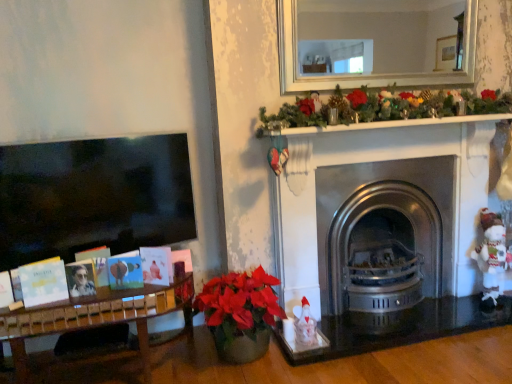
Question: From the image's perspective, is polished stainless steel fireplace at center below white knitted toy at right?

Choices:
 (A) yes
 (B) no

Answer: (B)

Question: Can you confirm if polished stainless steel fireplace at center is smaller than white knitted toy at right?

Choices:
 (A) no
 (B) yes

Answer: (A)

Question: Is polished stainless steel fireplace at center shorter than white knitted toy at right?

Choices:
 (A) yes
 (B) no

Answer: (B)

Question: From a real-world perspective, does polished stainless steel fireplace at center stand above white knitted toy at right?

Choices:
 (A) yes
 (B) no

Answer: (A)

Question: Would you say white knitted toy at right is part of polished stainless steel fireplace at center's contents?

Choices:
 (A) no
 (B) yes

Answer: (A)

Question: Considering the relative sizes of polished stainless steel fireplace at center and white knitted toy at right in the image provided, is polished stainless steel fireplace at center wider than white knitted toy at right?

Choices:
 (A) yes
 (B) no

Answer: (A)

Question: Is white knitted toy at right oriented towards polished stainless steel fireplace at center?

Choices:
 (A) no
 (B) yes

Answer: (A)

Question: Can you confirm if white knitted toy at right is taller than polished stainless steel fireplace at center?

Choices:
 (A) no
 (B) yes

Answer: (A)

Question: Is white knitted toy at right wider than polished stainless steel fireplace at center?

Choices:
 (A) no
 (B) yes

Answer: (A)

Question: Can you confirm if white knitted toy at right is smaller than polished stainless steel fireplace at center?

Choices:
 (A) no
 (B) yes

Answer: (B)

Question: Does white knitted toy at right come in front of polished stainless steel fireplace at center?

Choices:
 (A) no
 (B) yes

Answer: (A)

Question: Is white knitted toy at right to the left of polished stainless steel fireplace at center from the viewer's perspective?

Choices:
 (A) yes
 (B) no

Answer: (B)

Question: Would you say white knitted toy at right is outside matte black photo frame at left?

Choices:
 (A) yes
 (B) no

Answer: (A)